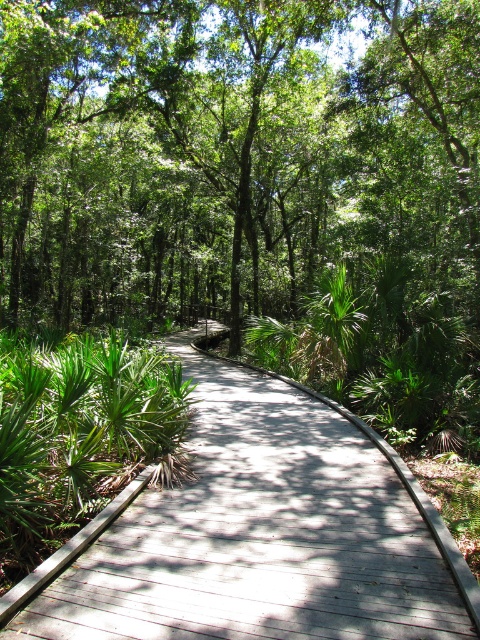
You are a hiker standing on the wooden boardwalk at center and looking towards the green leafy tree at center. Which object is taller?

The green leafy tree at center is taller than the wooden boardwalk at center.

You are standing on the wooden boardwalk at center and want to reach the green leafy tree at center. Which direction should you move to get closer to the tree?

You should move forward along the wooden boardwalk at center because the green leafy tree at center is further to the viewer than the boardwalk, meaning the tree is actually behind the boardwalk in the scene.